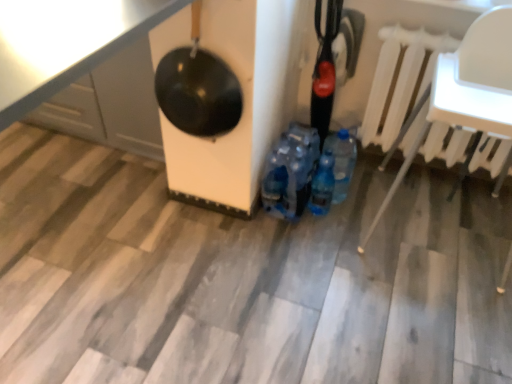
Where is `blue translucent bottle at center`? This screenshot has width=512, height=384. blue translucent bottle at center is located at coordinates (322, 185).

Identify the location of white plastic radiator at upper right. This screenshot has height=384, width=512. (400, 80).

What is the approximate width of black glossy wok at upper left?

black glossy wok at upper left is 6.16 inches in width.

This screenshot has height=384, width=512. What do you see at coordinates (198, 88) in the screenshot?
I see `black glossy wok at upper left` at bounding box center [198, 88].

This screenshot has height=384, width=512. I want to click on blue translucent bottle at center, so click(x=322, y=185).

From a real-world perspective, which object stands above the other?

shiny black pan at upper left is physically above.

Considering the relative sizes of blue translucent bottle at center and shiny black pan at upper left in the image provided, is blue translucent bottle at center shorter than shiny black pan at upper left?

Yes.

Considering the positions of objects blue translucent bottle at center and shiny black pan at upper left in the image provided, who is in front, blue translucent bottle at center or shiny black pan at upper left?

shiny black pan at upper left is closer to the camera.

Considering the relative sizes of blue translucent bottle at center and shiny black pan at upper left in the image provided, is blue translucent bottle at center wider than shiny black pan at upper left?

No, blue translucent bottle at center is not wider than shiny black pan at upper left.

Is shiny black pan at upper left not within white plastic radiator at upper right?

shiny black pan at upper left lies outside white plastic radiator at upper right's area.

Does shiny black pan at upper left have a lesser width compared to white plastic radiator at upper right?

No, shiny black pan at upper left is not thinner than white plastic radiator at upper right.

From the image's perspective, which is below, shiny black pan at upper left or white plastic radiator at upper right?

white plastic radiator at upper right.

Which object is further away from the camera, shiny black pan at upper left or white plastic radiator at upper right?

white plastic radiator at upper right is more distant.

From the picture: Is white plastic radiator at upper right bigger than black glossy wok at upper left?

Yes, white plastic radiator at upper right is bigger than black glossy wok at upper left.

Is the depth of white plastic radiator at upper right less than that of black glossy wok at upper left?

No, it is behind black glossy wok at upper left.

Is white plastic radiator at upper right beside black glossy wok at upper left?

white plastic radiator at upper right and black glossy wok at upper left are not in contact.

Would you say blue translucent bottle at center is part of white plastic radiator at upper right's contents?

No, blue translucent bottle at center is not surrounded by white plastic radiator at upper right.

Is white plastic radiator at upper right positioned with its back to blue translucent bottle at center?

No, white plastic radiator at upper right's orientation is not away from blue translucent bottle at center.

Can you confirm if white plastic radiator at upper right is bigger than blue translucent bottle at center?

Yes, white plastic radiator at upper right is bigger than blue translucent bottle at center.

Can we say black glossy wok at upper left lies outside blue translucent bottle at center?

Yes.

Is black glossy wok at upper left bigger than blue translucent bottle at center?

Indeed, black glossy wok at upper left has a larger size compared to blue translucent bottle at center.

Find the location of a particular element. The image size is (512, 384). bottle on the right of black glossy wok at upper left is located at coordinates (322, 185).

From a real-world perspective, which object rests below the other?

blue translucent bottle at center.

Find the location of `radiator on the right of blue translucent bottle at center`. radiator on the right of blue translucent bottle at center is located at coordinates [400, 80].

Considering the points (316, 210) and (438, 155), which point is in front, point (316, 210) or point (438, 155)?

Point (438, 155)

Are blue translucent bottle at center and white plastic radiator at upper right located far from each other?

→ They are positioned close to each other.

From a real-world perspective, is blue translucent bottle at center above or below black glossy wok at upper left?

blue translucent bottle at center is situated lower than black glossy wok at upper left in the real world.

Is blue translucent bottle at center touching black glossy wok at upper left?

blue translucent bottle at center and black glossy wok at upper left are clearly separated.

Is black glossy wok at upper left surrounded by blue translucent bottle at center?

No, black glossy wok at upper left is not inside blue translucent bottle at center.

Is blue translucent bottle at center oriented towards black glossy wok at upper left?

No, blue translucent bottle at center does not turn towards black glossy wok at upper left.

In the image, there is a shiny black pan at upper left. Where is `bottle below it (from the image's perspective)`? The width and height of the screenshot is (512, 384). bottle below it (from the image's perspective) is located at coordinates (322, 185).

This screenshot has height=384, width=512. I want to click on radiator above the shiny black pan at upper left (from a real-world perspective), so click(400, 80).

Considering their positions, is blue translucent bottle at center positioned closer to white plastic radiator at upper right than black glossy wok at upper left?

blue translucent bottle at center.

Estimate the real-world distances between objects in this image. Which object is further from black glossy wok at upper left, white plastic radiator at upper right or blue translucent bottle at center?

Based on the image, white plastic radiator at upper right appears to be further to black glossy wok at upper left.

Which object lies further to the anchor point blue translucent bottle at center, white plastic radiator at upper right or black glossy wok at upper left?

black glossy wok at upper left lies further to blue translucent bottle at center than the other object.

Looking at the image, which one is located further to blue translucent bottle at center, shiny black pan at upper left or white plastic radiator at upper right?

Based on the image, shiny black pan at upper left appears to be further to blue translucent bottle at center.

Which object lies nearer to the anchor point shiny black pan at upper left, blue translucent bottle at center or white plastic radiator at upper right?

The object closer to shiny black pan at upper left is blue translucent bottle at center.

Looking at the image, which one is located further to black glossy wok at upper left, shiny black pan at upper left or blue translucent bottle at center?

blue translucent bottle at center is positioned further to the anchor black glossy wok at upper left.

Looking at the image, which one is located closer to blue translucent bottle at center, white plastic radiator at upper right or shiny black pan at upper left?

white plastic radiator at upper right is closer to blue translucent bottle at center.

Looking at this image, from the image, which object appears to be farther from shiny black pan at upper left, white plastic radiator at upper right or blue translucent bottle at center?

The object further to shiny black pan at upper left is white plastic radiator at upper right.

This screenshot has width=512, height=384. Find the location of `wok located between shiny black pan at upper left and white plastic radiator at upper right in the left-right direction`. wok located between shiny black pan at upper left and white plastic radiator at upper right in the left-right direction is located at coordinates (198, 88).

Identify the location of bottle between black glossy wok at upper left and white plastic radiator at upper right from left to right. (322, 185).

Find the location of a particular element. bottle between shiny black pan at upper left and white plastic radiator at upper right from left to right is located at coordinates (322, 185).

You are a GUI agent. You are given a task and a screenshot of the screen. Output one action in this format:
    pyautogui.click(x=<x>, y=<y>)
    Task: Click on the wok between shiny black pan at upper left and blue translucent bottle at center
    This screenshot has height=384, width=512.
    Given the screenshot: What is the action you would take?
    pyautogui.click(x=198, y=88)